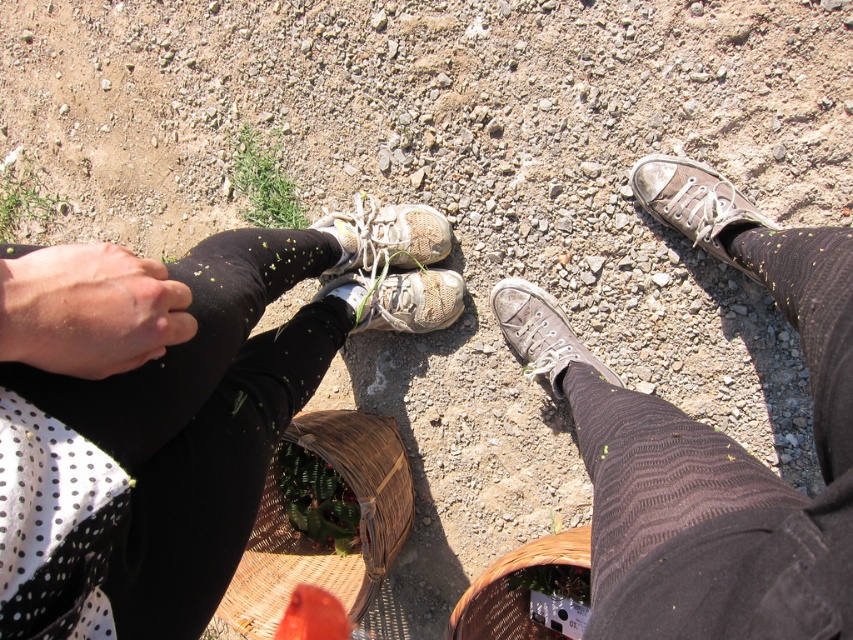
Question: Which object is positioned farthest from the white mesh shoe at center?

Choices:
 (A) matte black leggings at lower left
 (B) brown canvas sneaker at right
 (C) brown knitted sock at lower right

Answer: (C)

Question: Which of the following is the closest to the observer?

Choices:
 (A) brown canvas sneaker at right
 (B) brown canvas shoe at center
 (C) woven brown basket at lower center

Answer: (B)

Question: Is matte black leggings at lower left further to camera compared to matte gray sneaker at center?

Choices:
 (A) yes
 (B) no

Answer: (B)

Question: Does brown canvas sneaker at right have a smaller size compared to matte gray sneaker at center?

Choices:
 (A) yes
 (B) no

Answer: (A)

Question: Which of the following is the farthest from the observer?

Choices:
 (A) (509, 602)
 (B) (315, 426)
 (C) (718, 483)
 (D) (746, 506)

Answer: (A)

Question: Is brown knitted sock at lower right to the right of worn canvas shoe at center from the viewer's perspective?

Choices:
 (A) yes
 (B) no

Answer: (A)